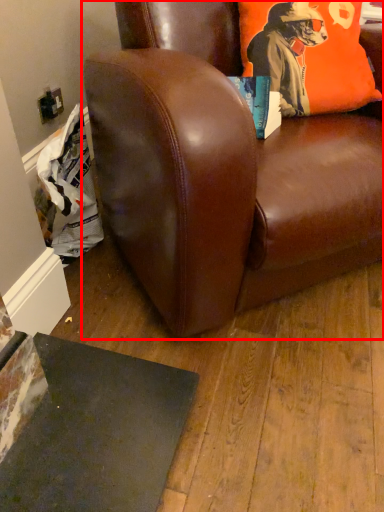
Question: From the image's perspective, where is chair (annotated by the red box) located relative to pillow?

Choices:
 (A) below
 (B) above

Answer: (A)